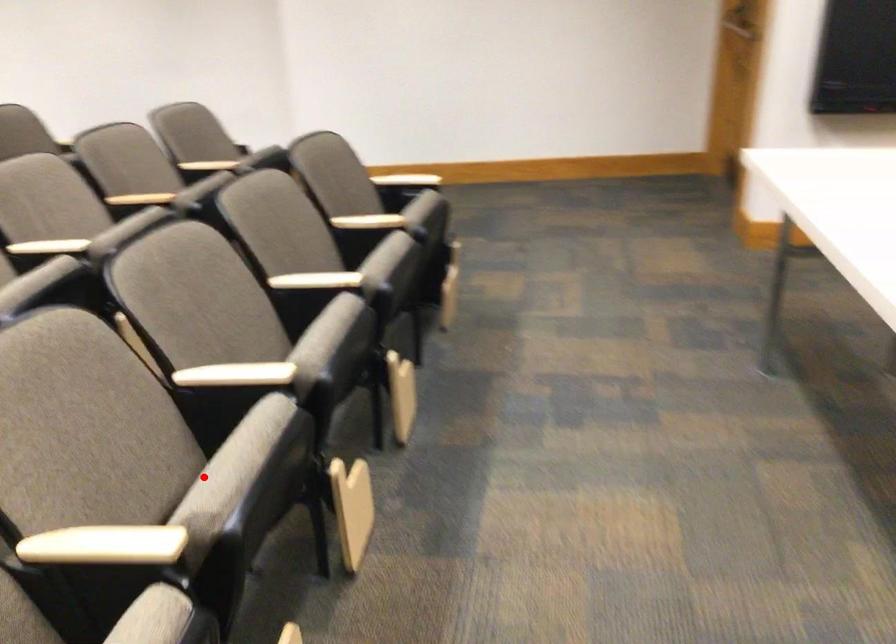
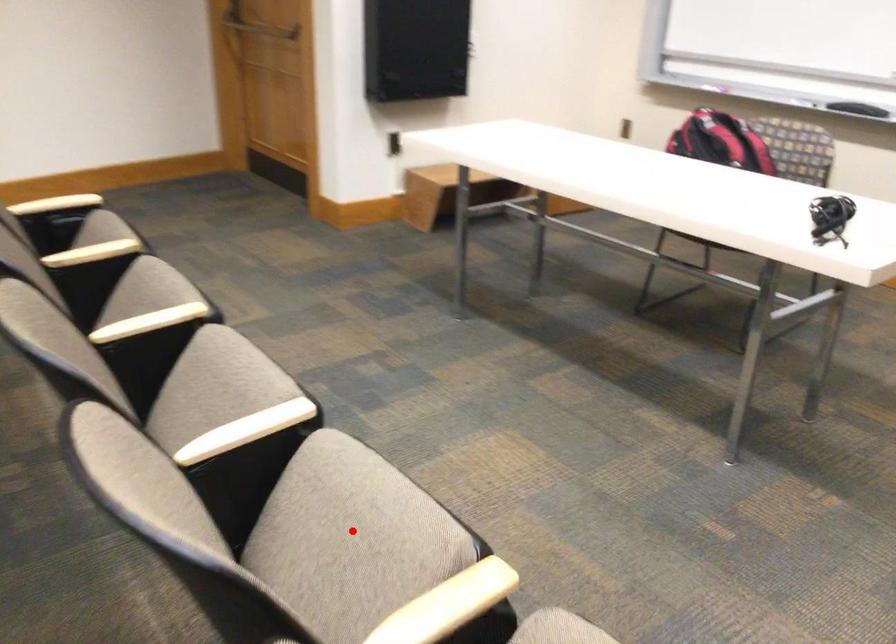
I am providing you with two images of the same scene from different viewpoints. A red point is marked on the first image and another point is marked on the second image. Does the point marked in image1 correspond to the same location as the one in image2?

Yes